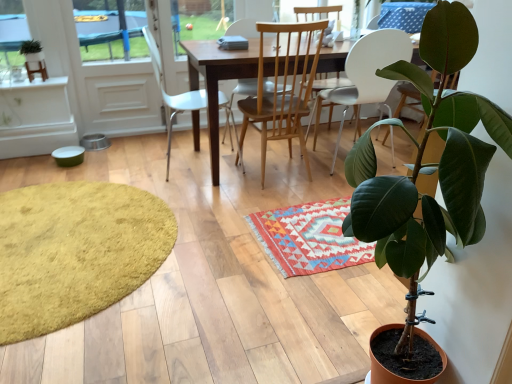
The image size is (512, 384). What are the coordinates of `free space to the left of multicolored woven rug at center, which appears as the 1th mat when viewed from the right` in the screenshot? It's located at (228, 234).